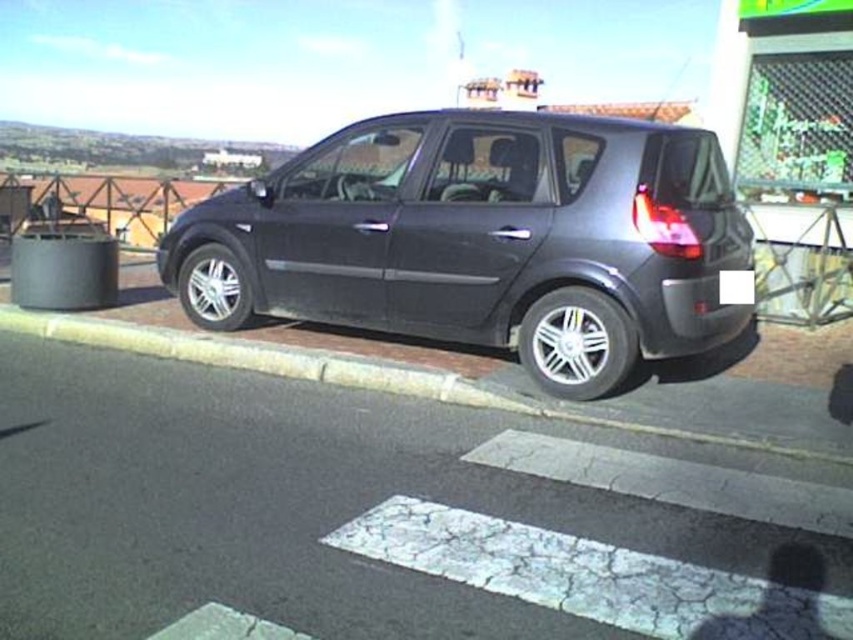
You are a delivery robot that needs to place a package on the sidewalk. The brick at lower center and the black plastic license plate at rear are both in your path. Which object is taller and must be avoided to prevent the package from being obstructed?

The brick at lower center is taller than the black plastic license plate at rear, so you should avoid the brick at lower center to prevent the package from being obstructed.

You are a delivery person trying to park your vehicle in a tight space between the satin black car at center and the brick at lower center. Based on their heights, which object would you need to be cautious of when lowering your delivery van to avoid collision?

The satin black car at center is taller than the brick at lower center, so you should be cautious of the satin black car at center when lowering your delivery van to avoid collision.